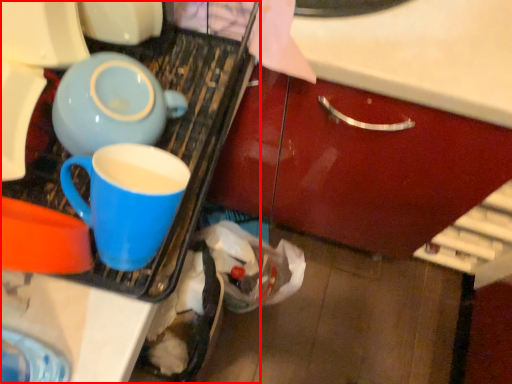
Question: From the image, what is the correct spatial relationship of appliance (annotated by the red box) in relation to coffee cup?

Choices:
 (A) left
 (B) right

Answer: (A)